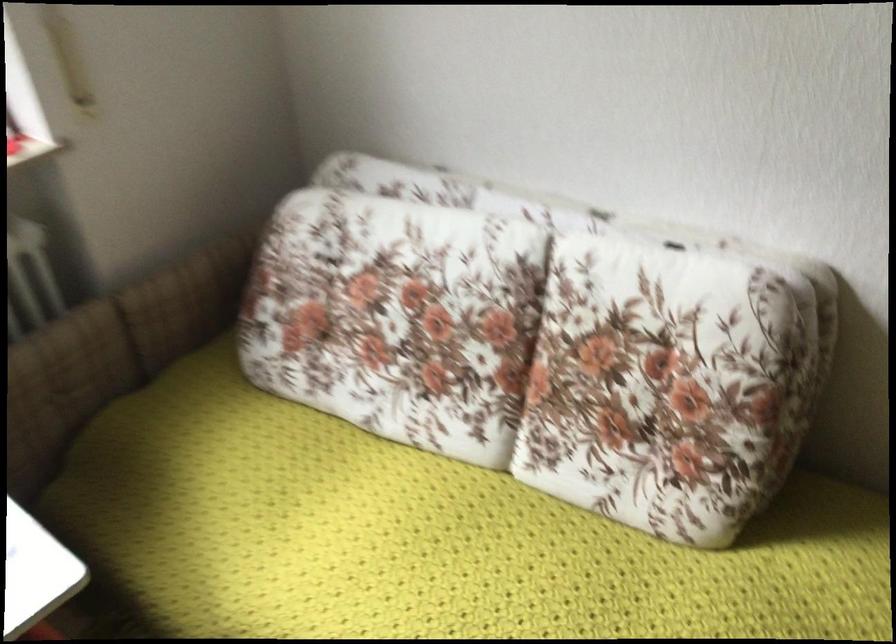
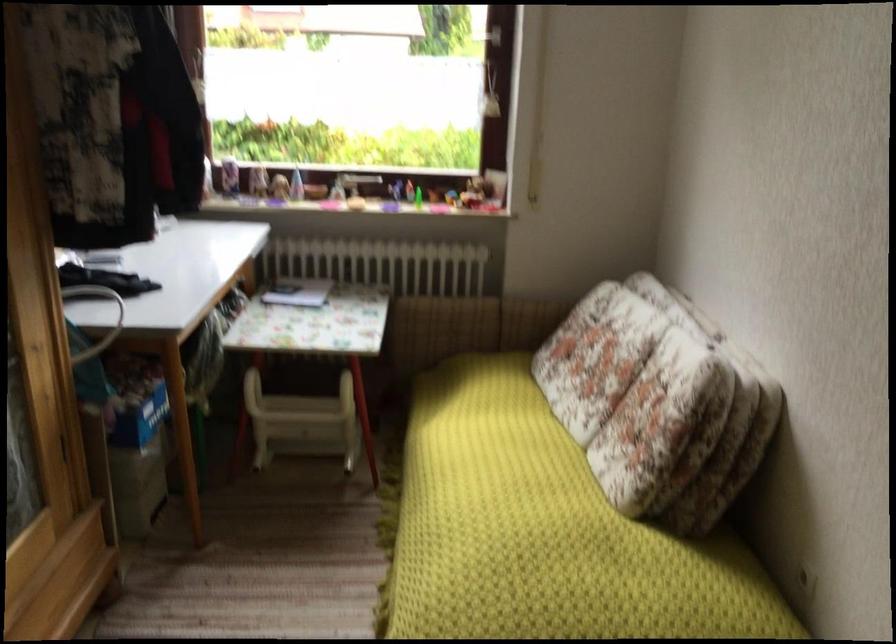
Find the pixel in the second image that matches (x=660, y=370) in the first image.

(658, 402)